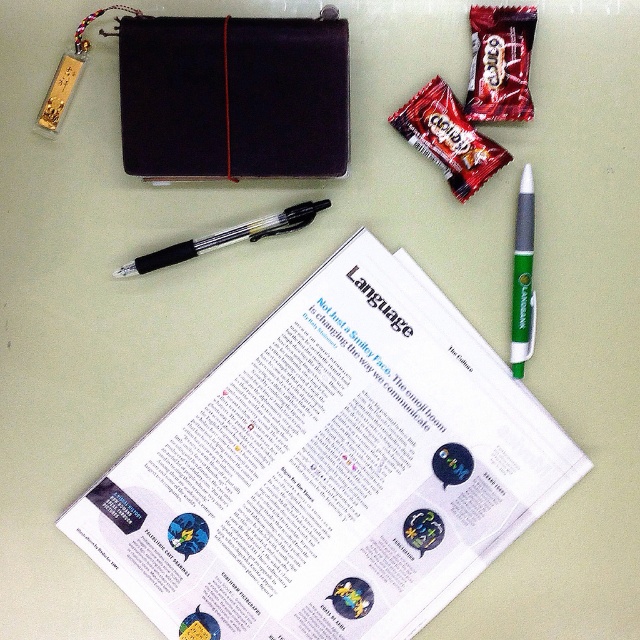
Does green plastic pen at upper right have a larger size compared to transparent plastic pen at center?

No.

I want to click on green plastic pen at upper right, so click(522, 276).

Is point (531, 241) in front of point (275, 214)?

Yes.

This screenshot has height=640, width=640. I want to click on green plastic pen at upper right, so click(522, 276).

Which is more to the left, white paper at center or green plastic pen at upper right?

white paper at center is more to the left.

Is white paper at center positioned at the back of green plastic pen at upper right?

Yes, it is behind green plastic pen at upper right.

Is point (442, 584) closer to camera compared to point (522, 305)?

No.

Where is `white paper at center`? This screenshot has height=640, width=640. white paper at center is located at coordinates (330, 468).

Which is below, black leather folder at upper center or green plastic pen at upper right?

green plastic pen at upper right is below.

Based on the photo, does black leather folder at upper center have a larger size compared to green plastic pen at upper right?

Indeed, black leather folder at upper center has a larger size compared to green plastic pen at upper right.

Which is behind, point (243, 77) or point (509, 358)?

The point (509, 358) is behind.

You are a GUI agent. You are given a task and a screenshot of the screen. Output one action in this format:
    pyautogui.click(x=<x>, y=<y>)
    Task: Click on the black leather folder at upper center
    This screenshot has width=640, height=640.
    Given the screenshot: What is the action you would take?
    pyautogui.click(x=234, y=97)